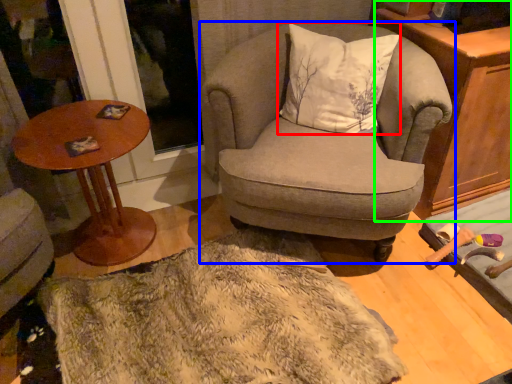
Question: Considering the real-world distances, which object is closest to pillow (highlighted by a red box)? chair (highlighted by a blue box) or cabinetry (highlighted by a green box).

Choices:
 (A) chair
 (B) cabinetry

Answer: (A)